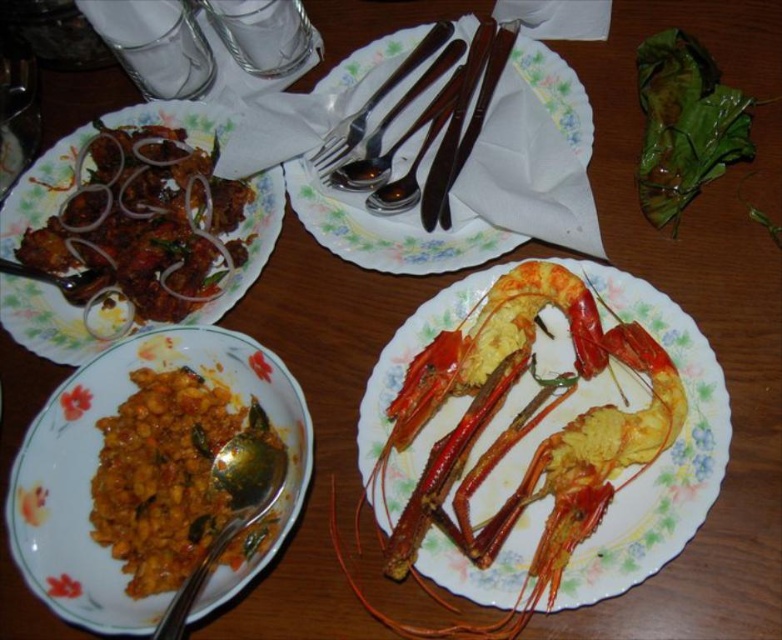
You are a guest at a dinner table and need to use the metallic silverware at center. Based on the table setup described, where should you place your hands to reach it?

The metallic silverware at center is located at point (391, 230), so you should place your hands at that coordinate to reach it.